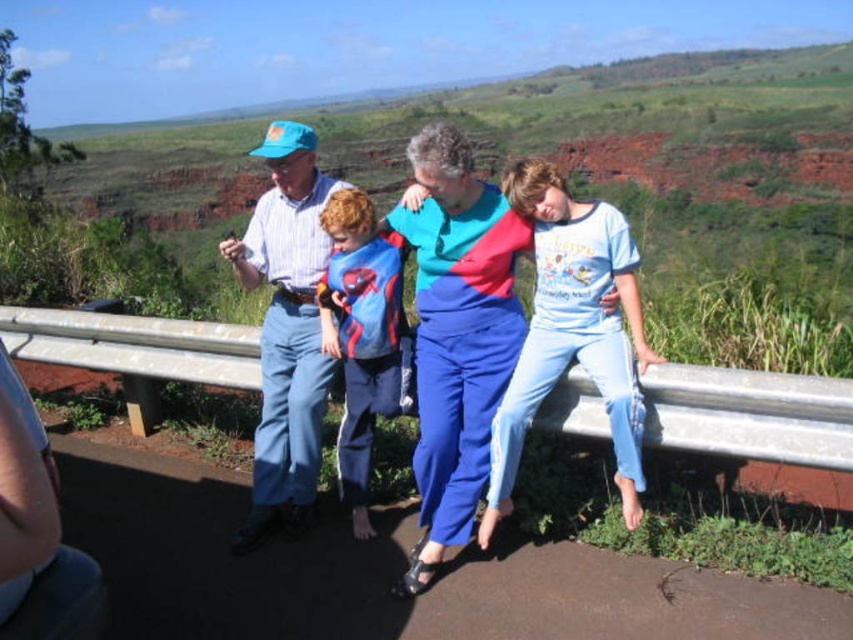
You are a photographer trying to capture a photo of the blue cotton pants at center while also including the green grassy hillside at upper center in the frame. Based on their positions, can you include both in the same shot without moving the camera?

Yes, since the green grassy hillside at upper center is located above the blue cotton pants at center, you can capture both in the same frame by adjusting the camera angle to include the area above the pants.

Based on the scene described, which object occupies a greater area in the image? Please choose between the green grassy hillside at upper center and the blue cotton pants at center.

The green grassy hillside at upper center is larger in size than the blue cotton pants at center, so it occupies a greater area in the image.

You are a fashion designer observing the group and want to create a new outfit combining the blue cotton pants at center and light blue cotton shirt at center. Which clothing item has a wider width to ensure the combination looks balanced?

The blue cotton pants at center have a greater width than the light blue cotton shirt at center, so pairing them would create a balanced look since the pants are wider.